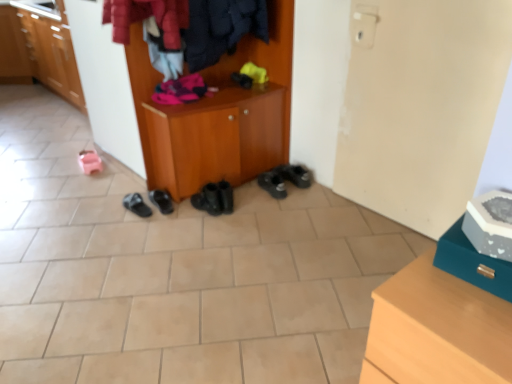
Locate an element on the screen. Image resolution: width=512 pixels, height=384 pixels. vacant space to the left of teal leather shoe at lower right, the 1th shoe ordered from the bottom is located at coordinates (435, 296).